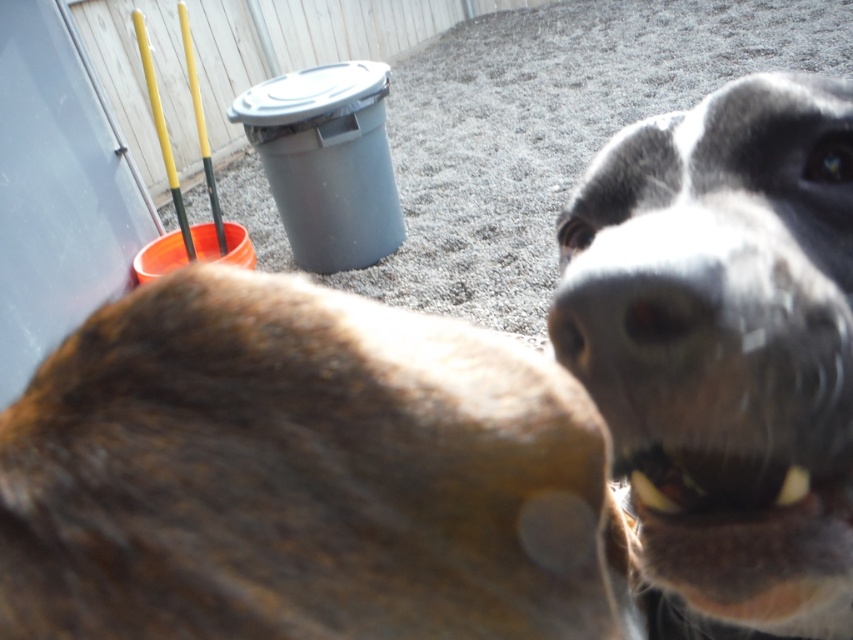
You are a photographer trying to capture a clear photo of the black fur dog at center and the black smooth nose at center. Since you want to focus on both, which one should you adjust your camera lens to prioritize focusing on first?

The black fur dog at center is taller than the black smooth nose at center, so you should prioritize focusing on the black fur dog at center first because it is larger in the frame.

Consider the image. You are a photographer trying to capture both the brown fur at center and the black smooth nose at center in a single shot. Which direction should you move your camera to ensure both are visible?

The brown fur at center is to the left of the black smooth nose at center. To include both in the frame, move the camera to the right so that the brown fur at center and the black smooth nose at center remain visible.

You are a photographer trying to capture both the black fur dog at center and the black smooth nose at center in a single shot. Given that the camera can only focus on one subject at a time, which subject should you focus on to ensure the larger one is in focus?

The black fur dog at center is larger in size than the black smooth nose at center, so you should focus on the black fur dog at center to ensure the larger one is in focus.